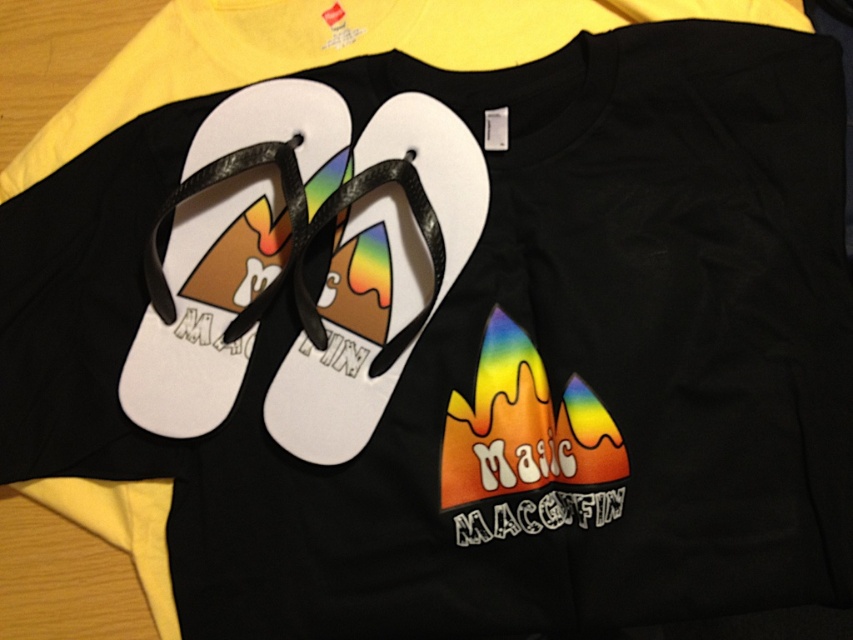
You are trying to decide which sandal to wear. Both the white matte sandal at center and the white rubber sandal at center are available. If you want to choose the larger one, which should you pick?

The white matte sandal at center is bigger than the white rubber sandal at center, so you should pick the white matte sandal at center.

You are a delivery robot that is 4 inches wide. You need to move from the black T shirt to the yellow garment without touching the flip flops. Can you fit through the space between the white matte sandal at center and the white rubber sandal at center?

The white matte sandal at center is 4.29 inches away from the white rubber sandal at center. Since the robot is 4 inches wide, it can fit through the space between the two sandals as the distance between them is greater than the robot width.

You are standing at the origin point in the image. Which of the two points, point (146, 385) or point (354, 176), is closer to you?

Point (146, 385) is in front of point (354, 176), so it is closer to you.